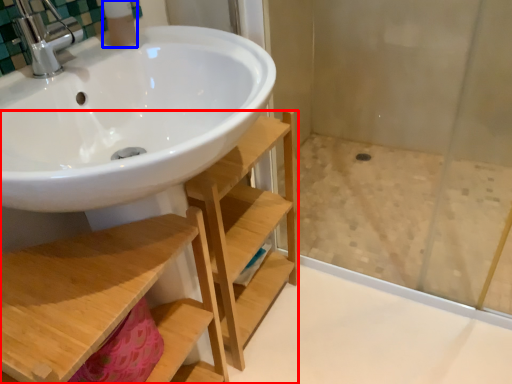
Question: Which of the following is the closest to the observer, shelf (highlighted by a red box) or toiletry (highlighted by a blue box)?

Choices:
 (A) shelf
 (B) toiletry

Answer: (A)